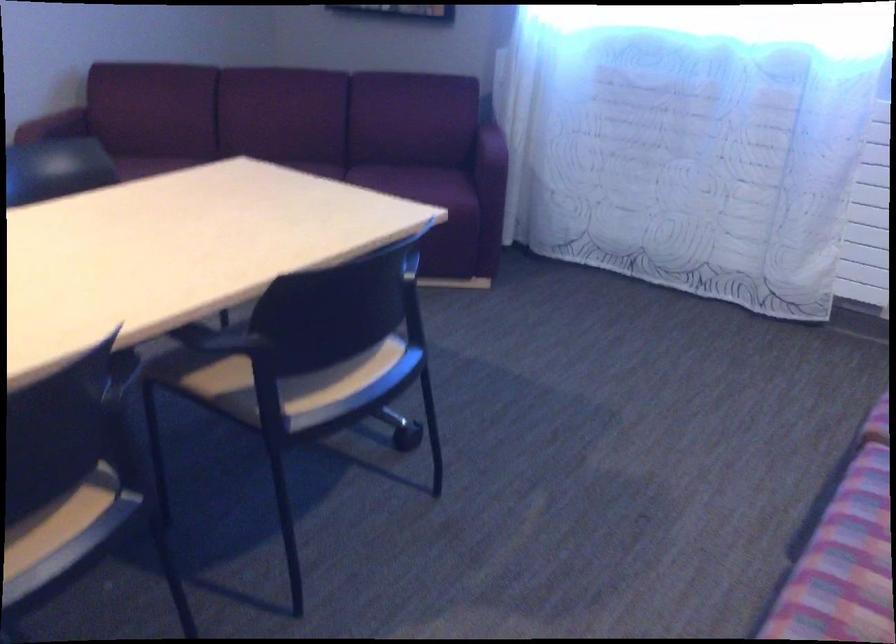
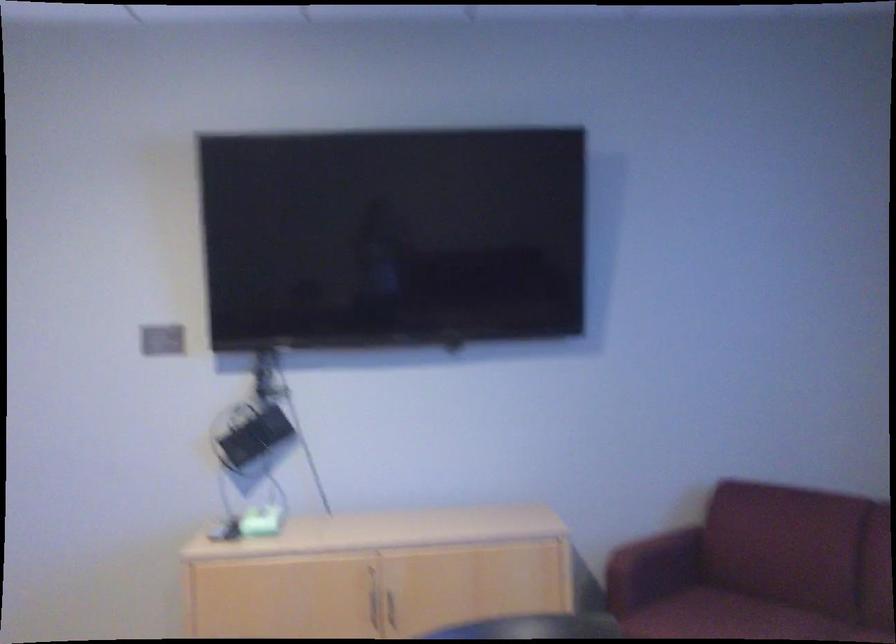
Question: The images are taken continuously from a first-person perspective. In which direction is your viewpoint rotating?

Choices:
 (A) Left
 (B) Right
 (C) Up
 (D) Down

Answer: (A)